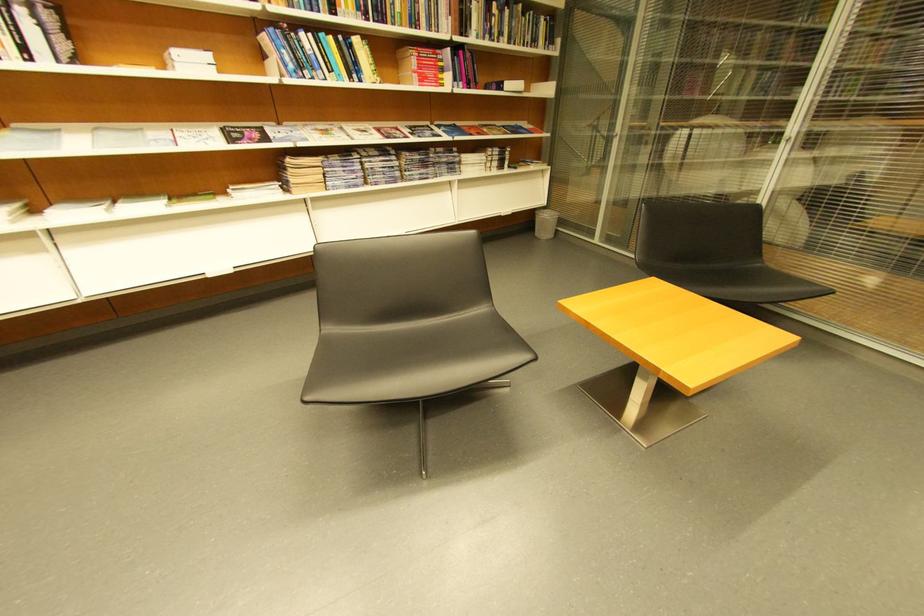
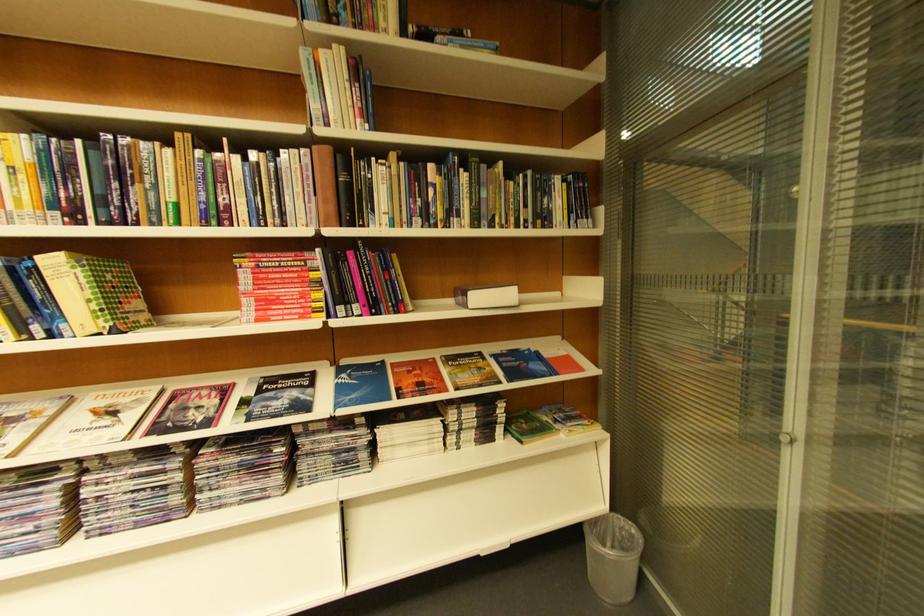
In the scene shown: In a continuous first-person perspective shot, in which direction is the camera moving?

The movement direction of the cameraman is right, forward.